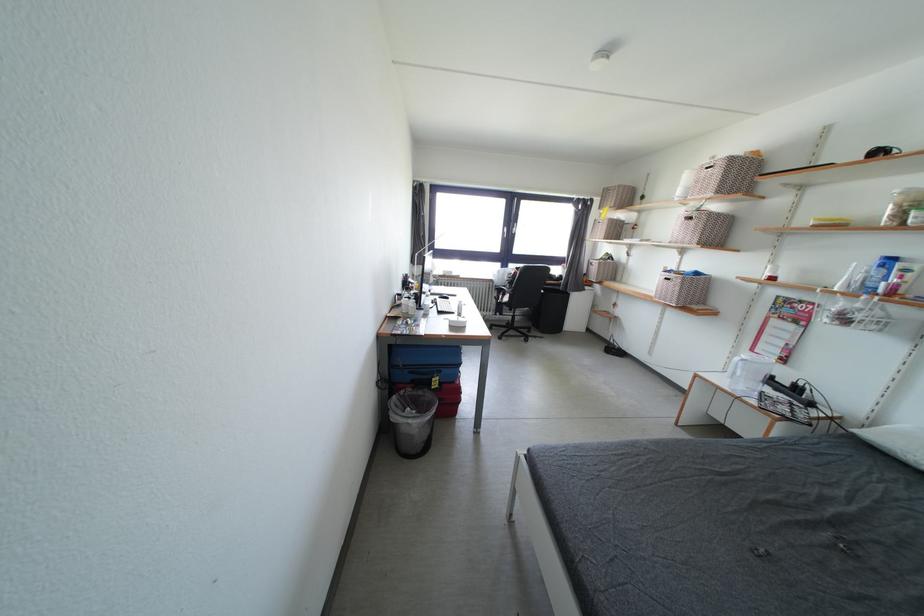
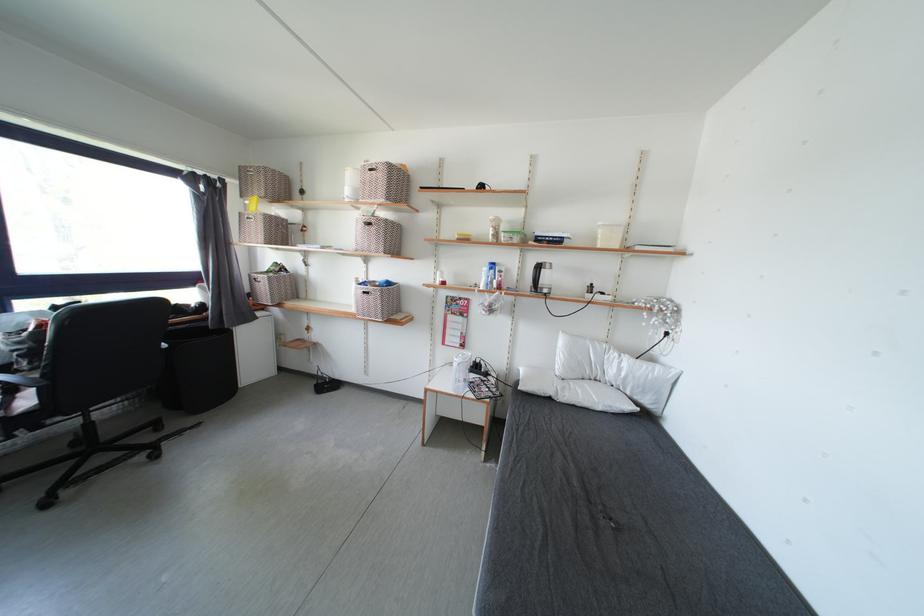
Question: The camera is either moving clockwise (left) or counter-clockwise (right) around the object. The first image is from the beginning of the video and the second image is from the end. Is the camera moving left or right when shooting the video?

Choices:
 (A) Left
 (B) Right

Answer: (A)